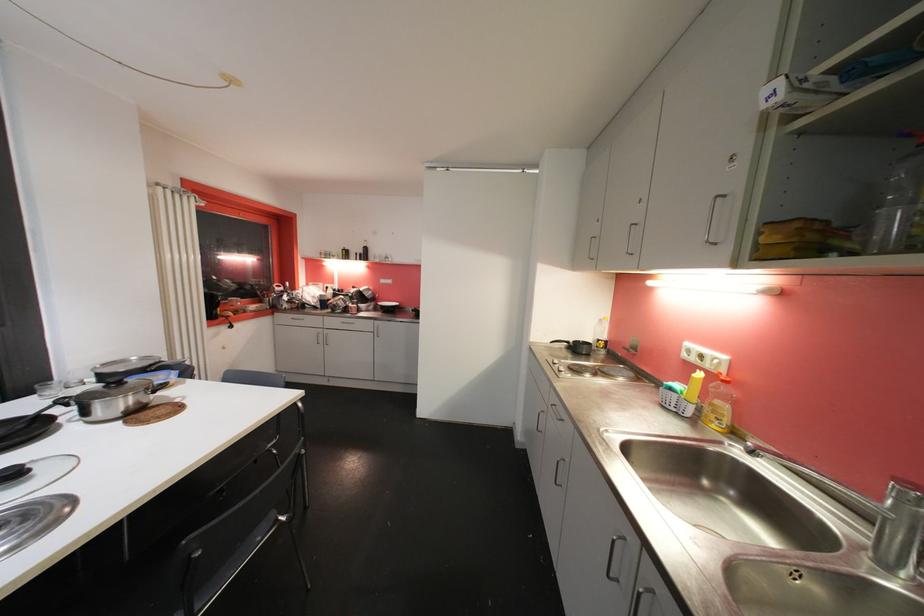
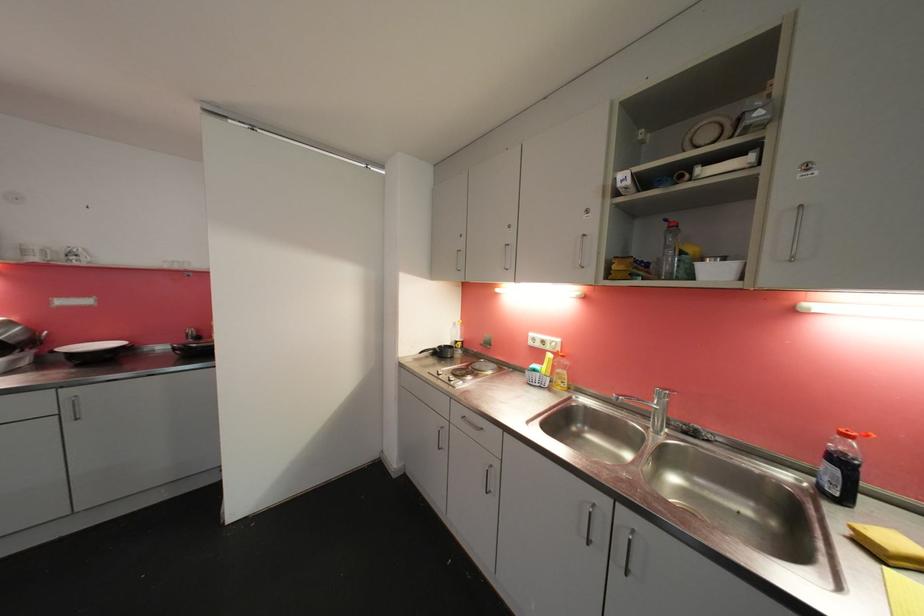
Question: The images are taken continuously from a first-person perspective. In which direction is your viewpoint rotating?

Choices:
 (A) Left
 (B) Right
 (C) Up
 (D) Down

Answer: (B)